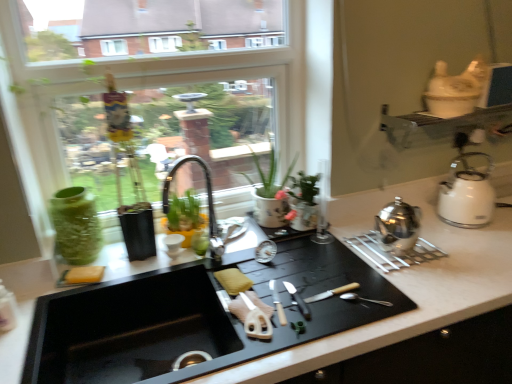
Question: Is the depth of yellow sponge at sink, placed as the 1th food when sorted from left to right, less than that of yellow sponge at sink, the first food in the right-to-left sequence?

Choices:
 (A) no
 (B) yes

Answer: (A)

Question: Is yellow sponge at sink, the 2th food in the right-to-left sequence, oriented towards yellow sponge at sink, the first food in the right-to-left sequence?

Choices:
 (A) no
 (B) yes

Answer: (A)

Question: From a real-world perspective, is yellow sponge at sink, placed as the 1th food when sorted from left to right, on yellow sponge at sink, which is the 2th food in left-to-right order?

Choices:
 (A) yes
 (B) no

Answer: (B)

Question: Considering the relative sizes of yellow sponge at sink, placed as the 1th food when sorted from left to right, and yellow sponge at sink, which is the 2th food in left-to-right order, in the image provided, is yellow sponge at sink, placed as the 1th food when sorted from left to right, shorter than yellow sponge at sink, which is the 2th food in left-to-right order,?

Choices:
 (A) yes
 (B) no

Answer: (A)

Question: Is yellow sponge at sink, placed as the 1th food when sorted from left to right, taller than yellow sponge at sink, the first food in the right-to-left sequence?

Choices:
 (A) yes
 (B) no

Answer: (B)

Question: From a real-world perspective, is satin silver teapot at right, placed as the 2th kitchen appliance when sorted from back to front, physically located above or below transparent glass window at upper center?

Choices:
 (A) below
 (B) above

Answer: (A)

Question: Relative to transparent glass window at upper center, is satin silver teapot at right, which ranks as the first kitchen appliance in left-to-right order, in front or behind?

Choices:
 (A) behind
 (B) front

Answer: (A)

Question: Is satin silver teapot at right, placed as the 2th kitchen appliance when sorted from back to front, wider or thinner than transparent glass window at upper center?

Choices:
 (A) wide
 (B) thin

Answer: (A)

Question: Is satin silver teapot at right, marked as the 2th kitchen appliance in a right-to-left arrangement, spatially inside transparent glass window at upper center, or outside of it?

Choices:
 (A) inside
 (B) outside

Answer: (B)

Question: From a real-world perspective, relative to satin silver teapot at right, marked as the 2th kitchen appliance in a right-to-left arrangement, is yellow sponge at sink, which is the 2th food in left-to-right order, vertically above or below?

Choices:
 (A) below
 (B) above

Answer: (A)

Question: Considering the relative positions of yellow sponge at sink, the first food in the right-to-left sequence, and satin silver teapot at right, which ranks as the first kitchen appliance in left-to-right order, in the image provided, is yellow sponge at sink, the first food in the right-to-left sequence, to the left or to the right of satin silver teapot at right, which ranks as the first kitchen appliance in left-to-right order,?

Choices:
 (A) left
 (B) right

Answer: (A)

Question: In terms of width, does yellow sponge at sink, the first food in the right-to-left sequence, look wider or thinner when compared to satin silver teapot at right, which ranks as the first kitchen appliance in left-to-right order?

Choices:
 (A) wide
 (B) thin

Answer: (B)

Question: In terms of height, does yellow sponge at sink, the first food in the right-to-left sequence, look taller or shorter compared to satin silver teapot at right, placed as the 2th kitchen appliance when sorted from back to front?

Choices:
 (A) tall
 (B) short

Answer: (B)

Question: Is matte black faucet at center in front of or behind silver metallic knife at center, the second knife from the left, in the image?

Choices:
 (A) behind
 (B) front

Answer: (A)

Question: From the image's perspective, is matte black faucet at center positioned above or below silver metallic knife at center, marked as the first knife in a right-to-left arrangement?

Choices:
 (A) below
 (B) above

Answer: (B)